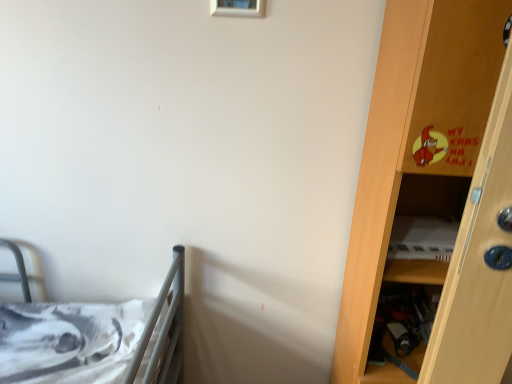
In order to face white plastic window at upper center, should I rotate leftwards or rightwards?

Rotate your view left by about 2.079°.

Find the location of a particular element. This screenshot has width=512, height=384. white plastic window at upper center is located at coordinates (238, 8).

This screenshot has width=512, height=384. What do you see at coordinates (238, 8) in the screenshot?
I see `white plastic window at upper center` at bounding box center [238, 8].

You are a GUI agent. You are given a task and a screenshot of the screen. Output one action in this format:
    pyautogui.click(x=<x>, y=<y>)
    Task: Click on the white plastic window at upper center
    
    Given the screenshot: What is the action you would take?
    238,8